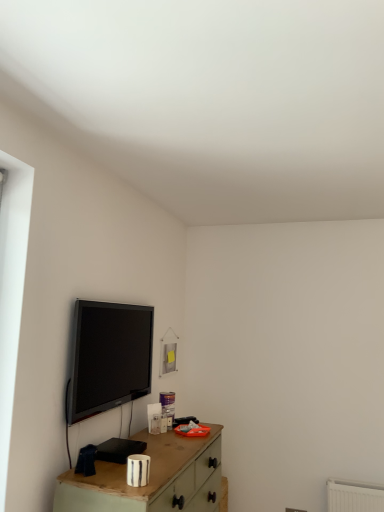
Question: Considering the positions of wooden table at lower center and black glossy tv at upper left in the image, is wooden table at lower center bigger or smaller than black glossy tv at upper left?

Choices:
 (A) small
 (B) big

Answer: (B)

Question: Is wooden table at lower center wider or thinner than black glossy tv at upper left?

Choices:
 (A) wide
 (B) thin

Answer: (A)

Question: From a real-world perspective, is wooden table at lower center positioned above or below black glossy tv at upper left?

Choices:
 (A) above
 (B) below

Answer: (B)

Question: From a real-world perspective, is black glossy tv at upper left physically located above or below wooden table at lower center?

Choices:
 (A) below
 (B) above

Answer: (B)

Question: In the image, is black glossy tv at upper left positioned in front of or behind wooden table at lower center?

Choices:
 (A) behind
 (B) front

Answer: (A)

Question: In terms of size, does black glossy tv at upper left appear bigger or smaller than wooden table at lower center?

Choices:
 (A) small
 (B) big

Answer: (A)

Question: Based on their positions, is black glossy tv at upper left located to the left or right of wooden table at lower center?

Choices:
 (A) right
 (B) left

Answer: (B)